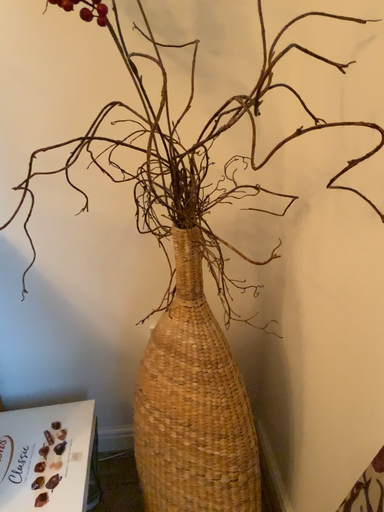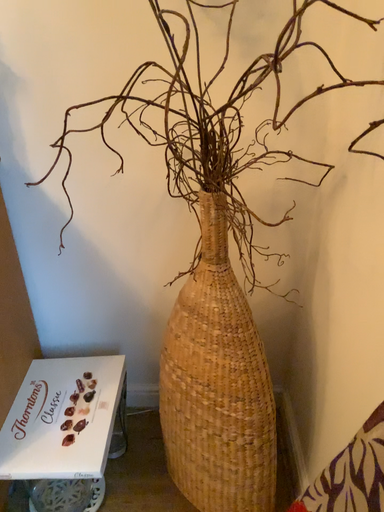
Question: How did the camera likely rotate when shooting the video?

Choices:
 (A) rotated left
 (B) rotated right

Answer: (A)